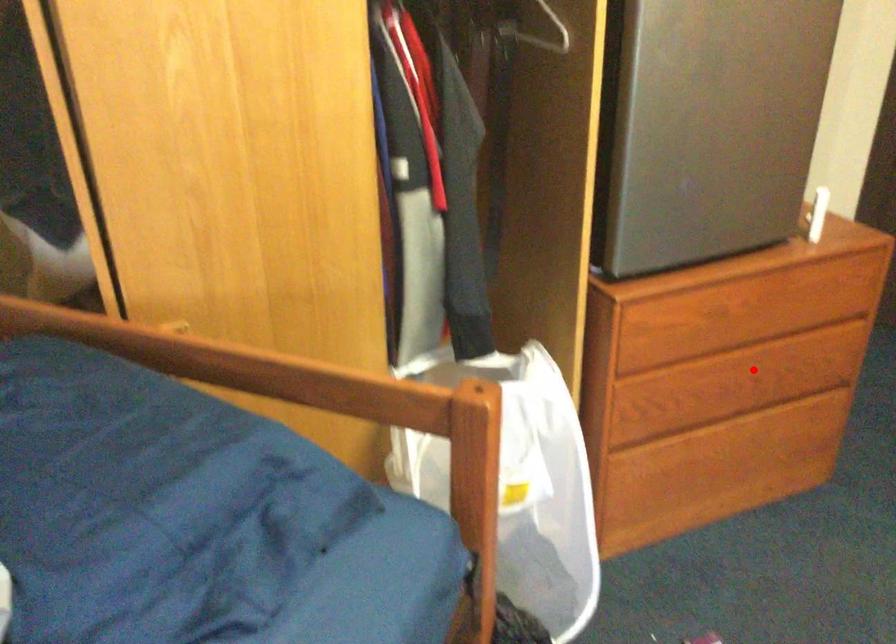
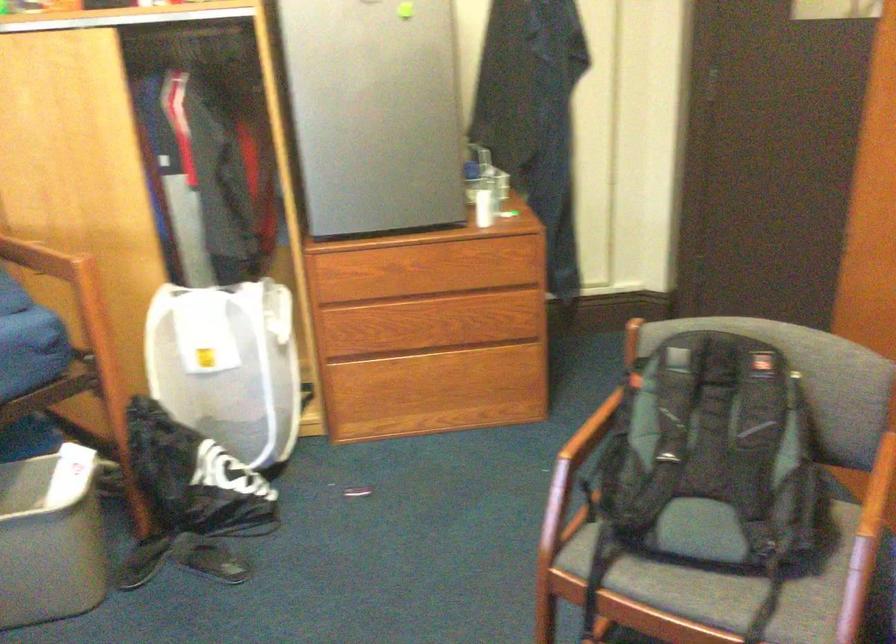
Question: A red point is marked in image1. In image2, is the corresponding 3D point closer to the camera or farther? Reply with the corresponding letter.

Choices:
 (A) The corresponding 3D point is closer.
 (B) The corresponding 3D point is farther.

Answer: (B)